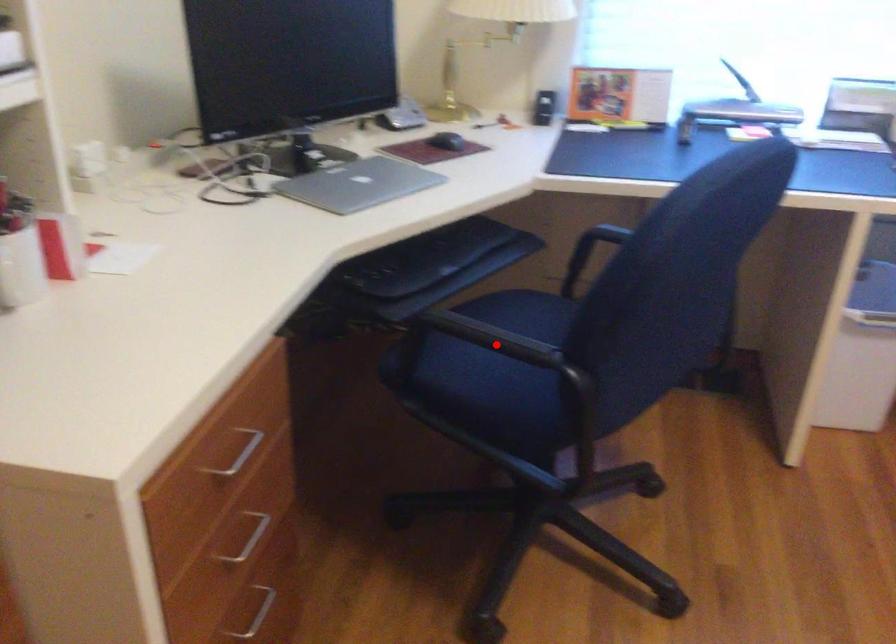
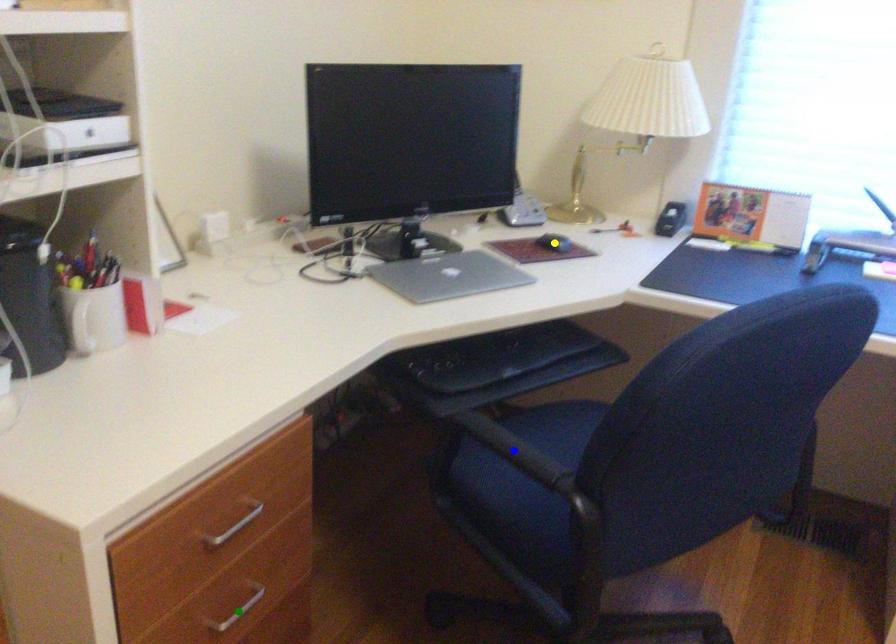
Question: I am providing you with two images of the same scene from different viewpoints. A red point is marked on the first image. You are given multiple points on the second image. In image 2, which mark is for the same physical point as the one in image 1?

Choices:
 (A) green point
 (B) blue point
 (C) yellow point

Answer: (B)